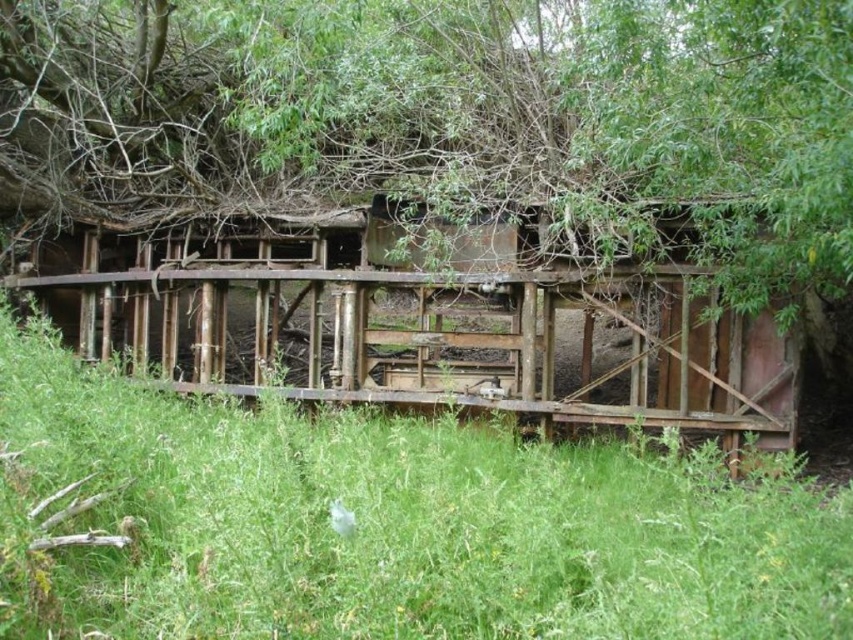
Question: From the image, what is the correct spatial relationship of green grassy at center in relation to rusty wood hut at center?

Choices:
 (A) left
 (B) right

Answer: (B)

Question: Which of the following is the farthest from the observer?

Choices:
 (A) green leafy tree at upper center
 (B) green grassy at center

Answer: (A)

Question: Is green leafy tree at upper center in front of rusty wood hut at center?

Choices:
 (A) yes
 (B) no

Answer: (B)

Question: Among these points, which one is farthest from the camera?

Choices:
 (A) (737, 401)
 (B) (488, 525)
 (C) (838, 227)

Answer: (A)

Question: Does green leafy tree at upper center lie in front of rusty wood hut at center?

Choices:
 (A) yes
 (B) no

Answer: (B)

Question: Among these objects, which one is nearest to the camera?

Choices:
 (A) green leafy tree at upper center
 (B) rusty wood hut at center
 (C) green grassy at center

Answer: (C)